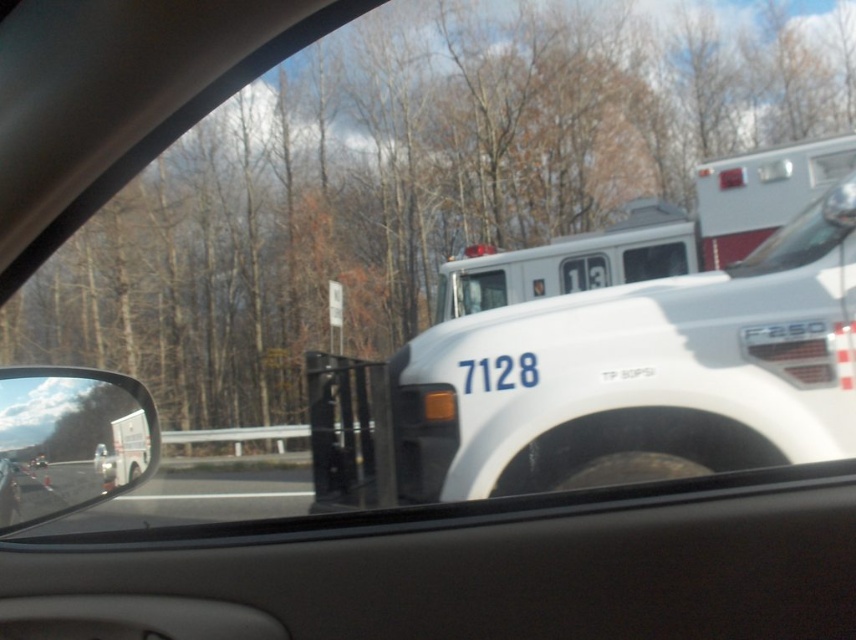
Based on the photo, you are a passenger in a car and you want to know if the white glossy fire truck at upper center can fit through a narrow alley that is as wide as the clear glass windshield at upper right. Based on the scene, can it fit?

The white glossy fire truck at upper center is wider than the clear glass windshield at upper right. Since the alley is as wide as the windshield, the fire truck cannot fit through the alley.

You are driving a car and see a white emergency vehicle ahead with the number 7128 on it. There is a point at coordinates point [52,488]. Can you safely pass the emergency vehicle without crossing into the opposite lane?

The point at coordinates point [52,488] is 2.25 meters away from the emergency vehicle. Since the distance is sufficient, you can safely pass the emergency vehicle without crossing into the opposite lane as long as there is enough space to maneuver safely within your lane.

You are driving and see the white glossy fire truck at upper center and the white glossy truck at left ahead on the road. Which vehicle is positioned higher in your field of view?

The white glossy fire truck at upper center is positioned higher in your field of view than the white glossy truck at left.